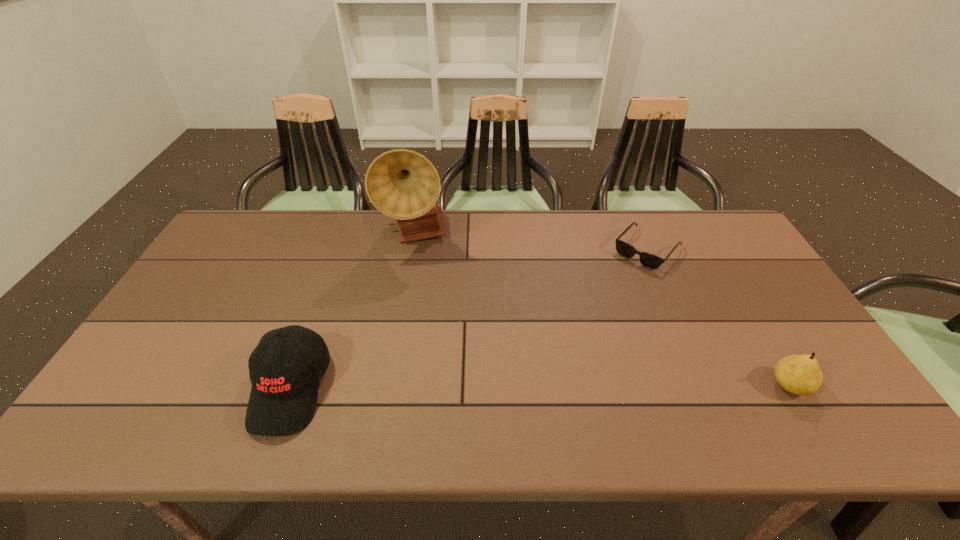
Find the location of a particular element. vacant region located on the horn of the tallest object is located at coordinates (456, 280).

You are a GUI agent. You are given a task and a screenshot of the screen. Output one action in this format:
    pyautogui.click(x=<x>, y=<y>)
    Task: Click on the free location located 0.160m on the horn of the tallest object
    Image resolution: width=960 pixels, height=540 pixels.
    Given the screenshot: What is the action you would take?
    pyautogui.click(x=460, y=284)

Identify the location of vacant region located 0.090m on the horn of the tallest object. (446, 271).

Locate an element on the screen. sunglasses located in the far edge section of the desktop is located at coordinates (648, 260).

Identify the location of phonograph record situated at the far edge. point(403,184).

This screenshot has width=960, height=540. In order to click on baseball cap located in the near edge section of the desktop in this screenshot , I will do `click(283, 397)`.

Find the location of a particular element. pear that is at the near edge is located at coordinates (799, 374).

Where is `object at the right edge`? object at the right edge is located at coordinates (799, 374).

This screenshot has width=960, height=540. I want to click on object that is at the near right corner, so click(799, 374).

I want to click on vacant space at the far edge of the desktop, so click(x=373, y=247).